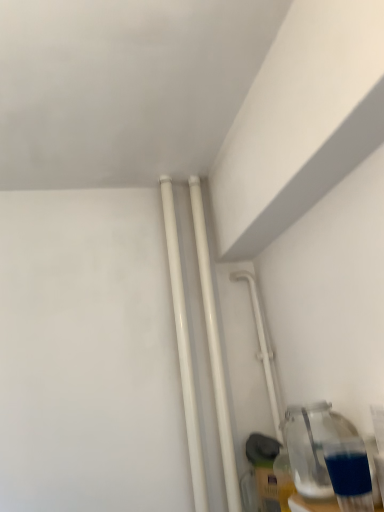
Question: From a real-world perspective, is white glossy pipe at center-right located beneath white glossy pipes at center, which is the second pipe from right to left?

Choices:
 (A) yes
 (B) no

Answer: (A)

Question: Are white glossy pipe at center-right and white glossy pipes at center, acting as the first pipe starting from the left, making contact?

Choices:
 (A) no
 (B) yes

Answer: (A)

Question: Does white glossy pipe at center-right have a smaller size compared to white glossy pipes at center, which is the second pipe from right to left?

Choices:
 (A) no
 (B) yes

Answer: (A)

Question: Are white glossy pipe at center-right and white glossy pipes at center, acting as the first pipe starting from the left, far apart?

Choices:
 (A) no
 (B) yes

Answer: (A)

Question: Is white glossy pipe at center-right wider than white glossy pipes at center, which is the second pipe from right to left?

Choices:
 (A) yes
 (B) no

Answer: (A)

Question: Is white glossy pipe at center-right looking in the opposite direction of white glossy pipes at center, acting as the first pipe starting from the left?

Choices:
 (A) no
 (B) yes

Answer: (A)

Question: From a real-world perspective, is white glossy pipes at center, which is the second pipe from right to left, located higher than white glossy pipe at center-right?

Choices:
 (A) yes
 (B) no

Answer: (A)

Question: Can you confirm if white glossy pipes at center, acting as the first pipe starting from the left, is thinner than white glossy pipe at center-right?

Choices:
 (A) yes
 (B) no

Answer: (A)

Question: Is white glossy pipes at center, acting as the first pipe starting from the left, shorter than white glossy pipe at center-right?

Choices:
 (A) yes
 (B) no

Answer: (B)

Question: Is the depth of white glossy pipes at center, acting as the first pipe starting from the left, greater than that of white glossy pipe at center-right?

Choices:
 (A) no
 (B) yes

Answer: (A)

Question: Does white glossy pipes at center, acting as the first pipe starting from the left, have a smaller size compared to white glossy pipe at center-right?

Choices:
 (A) no
 (B) yes

Answer: (B)

Question: Considering the relative sizes of white glossy pipes at center, which is the second pipe from right to left, and white glossy pipe at center-right in the image provided, is white glossy pipes at center, which is the second pipe from right to left, wider than white glossy pipe at center-right?

Choices:
 (A) no
 (B) yes

Answer: (A)

Question: Could you tell me if white glossy pipe at center-right is facing transparent glass bottle at lower right?

Choices:
 (A) no
 (B) yes

Answer: (B)